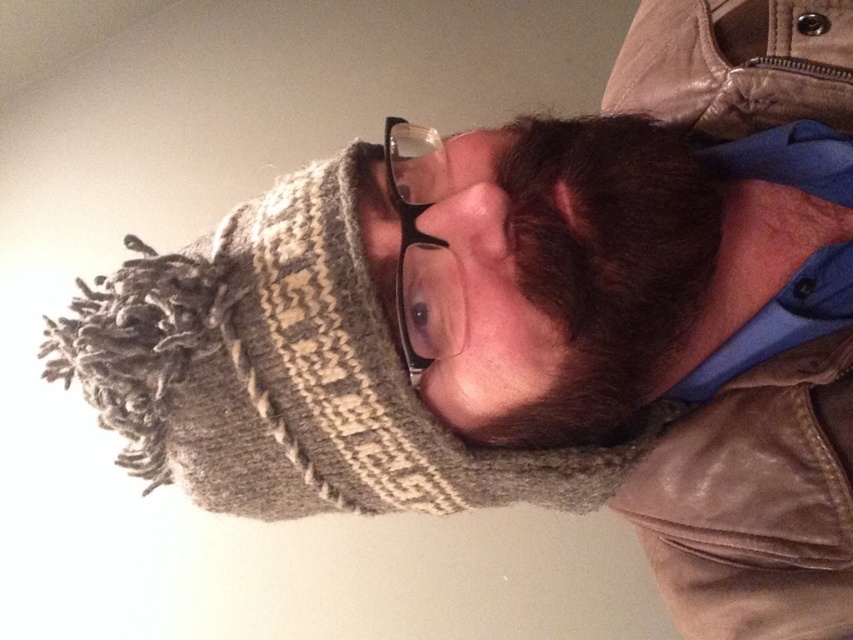
Find the location of a particular element. leather jacket at right is located at coordinates (755, 502).

Is point (808, 49) more distant than point (653, 250)?

Yes, it is behind point (653, 250).

You are a GUI agent. You are given a task and a screenshot of the screen. Output one action in this format:
    pyautogui.click(x=<x>, y=<y>)
    Task: Click on the leather jacket at right
    Image resolution: width=853 pixels, height=640 pixels.
    Given the screenshot: What is the action you would take?
    pyautogui.click(x=755, y=502)